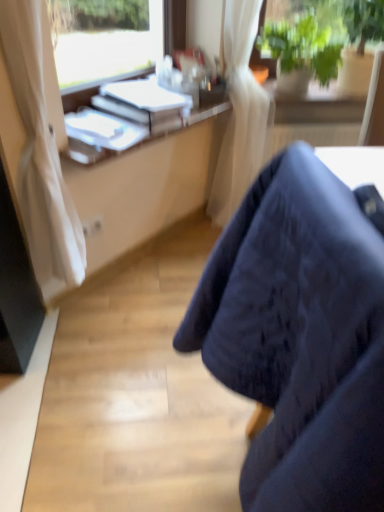
In order to face white plastic desk at upper left, should I rotate leftwards or rightwards?

To face it directly, rotate left by 4.830 degrees.

Identify the location of white paper at upper center, which is the 1th book from top to bottom. The width and height of the screenshot is (384, 512). (144, 104).

What do you see at coordinates (326, 41) in the screenshot? The width and height of the screenshot is (384, 512). I see `green leafy plant at upper right` at bounding box center [326, 41].

Describe the element at coordinates (300, 337) in the screenshot. The image size is (384, 512). I see `dark fabric chair at lower right` at that location.

At what (x,y) coordinates should I click in order to perform the action: click on white plastic desk at upper left. Please return your answer as a coordinate pair (x, y). This screenshot has width=384, height=512. Looking at the image, I should click on [88, 150].

Considering the sizes of objects white paper at upper center, which ranks as the second book in bottom-to-top order, and dark fabric chair at lower right in the image provided, who is shorter, white paper at upper center, which ranks as the second book in bottom-to-top order, or dark fabric chair at lower right?

With less height is white paper at upper center, which ranks as the second book in bottom-to-top order.

From the image's perspective, which object appears higher, white paper at upper center, which is the 1th book from top to bottom, or dark fabric chair at lower right?

white paper at upper center, which is the 1th book from top to bottom, from the image's perspective.

Who is bigger, white plastic desk at upper left or green leafy plant at upper right?

With larger size is green leafy plant at upper right.

Does white plastic desk at upper left come behind green leafy plant at upper right?

No, white plastic desk at upper left is in front of green leafy plant at upper right.

From the picture: How far apart are white plastic desk at upper left and green leafy plant at upper right?

They are 23.43 inches apart.

The image size is (384, 512). I want to click on desk in front of the green leafy plant at upper right, so click(88, 150).

Considering the sizes of white plastic desk at upper left and white paper at upper center, which is the 1th book from top to bottom, in the image, is white plastic desk at upper left bigger or smaller than white paper at upper center, which is the 1th book from top to bottom,?

Considering their sizes, white plastic desk at upper left takes up less space than white paper at upper center, which is the 1th book from top to bottom.

Does white plastic desk at upper left lie behind white paper at upper center, which ranks as the second book in bottom-to-top order?

No, the depth of white plastic desk at upper left is less than that of white paper at upper center, which ranks as the second book in bottom-to-top order.

From the image's perspective, would you say white plastic desk at upper left is positioned over white paper at upper center, which is the 1th book from top to bottom?

No.

From the picture: Considering the sizes of white plastic desk at upper left and white paper at upper center, which is the 1th book from top to bottom, in the image, is white plastic desk at upper left wider or thinner than white paper at upper center, which is the 1th book from top to bottom,?

Clearly, white plastic desk at upper left has less width compared to white paper at upper center, which is the 1th book from top to bottom.

Would you say green leafy plant at upper right is to the left or to the right of dark fabric chair at lower right in the picture?

In the image, green leafy plant at upper right appears on the right side of dark fabric chair at lower right.

Is green leafy plant at upper right shorter than dark fabric chair at lower right?

Yes, green leafy plant at upper right is shorter than dark fabric chair at lower right.

From the image's perspective, between white glossy book at upper left, arranged as the second book when viewed from the top, and white plastic desk at upper left, which one is located above?

white plastic desk at upper left appears higher in the image.

Which is farther from the camera, [81,110] or [191,123]?

The point [191,123] is farther.

Is white glossy book at upper left, placed as the 1th book when sorted from bottom to top, taller than white plastic desk at upper left?

Indeed, white glossy book at upper left, placed as the 1th book when sorted from bottom to top, has a greater height compared to white plastic desk at upper left.

Looking at this image, from the image's perspective, who appears lower, white plastic desk at upper left or dark fabric chair at lower right?

dark fabric chair at lower right.

Which is more to the right, white plastic desk at upper left or dark fabric chair at lower right?

Positioned to the right is dark fabric chair at lower right.

Which is more distant, (71, 149) or (275, 292)?

Point (71, 149)

Do you think white paper at upper center, which ranks as the second book in bottom-to-top order, is within white plastic desk at upper left, or outside of it?

white paper at upper center, which ranks as the second book in bottom-to-top order, is located beyond the bounds of white plastic desk at upper left.

Is white paper at upper center, which is the 1th book from top to bottom, positioned with its back to white plastic desk at upper left?

That's not correct — white paper at upper center, which is the 1th book from top to bottom, is not looking away from white plastic desk at upper left.

What's the angular difference between white paper at upper center, which is the 1th book from top to bottom, and white plastic desk at upper left's facing directions?

The angle between the facing direction of white paper at upper center, which is the 1th book from top to bottom, and the facing direction of white plastic desk at upper left is 0.000526 degrees.

From the image's perspective, between white paper at upper center, which is the 1th book from top to bottom, and white plastic desk at upper left, which one is located above?

white paper at upper center, which is the 1th book from top to bottom, is shown above in the image.

Where is `chair in front of the white paper at upper center, which is the 1th book from top to bottom`? This screenshot has width=384, height=512. chair in front of the white paper at upper center, which is the 1th book from top to bottom is located at coordinates (300, 337).

The width and height of the screenshot is (384, 512). I want to click on houseplant behind the white plastic desk at upper left, so click(326, 41).

Looking at the image, which one is located closer to dark fabric chair at lower right, white plastic desk at upper left or white glossy book at upper left, placed as the 1th book when sorted from bottom to top?

Based on the image, white glossy book at upper left, placed as the 1th book when sorted from bottom to top, appears to be nearer to dark fabric chair at lower right.

Which object lies nearer to the anchor point white glossy book at upper left, arranged as the second book when viewed from the top, white paper at upper center, which ranks as the second book in bottom-to-top order, or green leafy plant at upper right?

white paper at upper center, which ranks as the second book in bottom-to-top order, lies closer to white glossy book at upper left, arranged as the second book when viewed from the top, than the other object.

Considering their positions, is white glossy book at upper left, arranged as the second book when viewed from the top, positioned further to white plastic desk at upper left than dark fabric chair at lower right?

dark fabric chair at lower right.

Looking at the image, which one is located closer to dark fabric chair at lower right, white glossy book at upper left, arranged as the second book when viewed from the top, or white plastic desk at upper left?

The object closer to dark fabric chair at lower right is white glossy book at upper left, arranged as the second book when viewed from the top.

From the image, which object appears to be nearer to white plastic desk at upper left, green leafy plant at upper right or white paper at upper center, which is the 1th book from top to bottom?

white paper at upper center, which is the 1th book from top to bottom, is closer to white plastic desk at upper left.

Based on their spatial positions, is dark fabric chair at lower right or white paper at upper center, which is the 1th book from top to bottom, further from white glossy book at upper left, placed as the 1th book when sorted from bottom to top?

dark fabric chair at lower right lies further to white glossy book at upper left, placed as the 1th book when sorted from bottom to top, than the other object.

Considering their positions, is white glossy book at upper left, placed as the 1th book when sorted from bottom to top, positioned further to white plastic desk at upper left than green leafy plant at upper right?

The object further to white plastic desk at upper left is green leafy plant at upper right.

From the image, which object appears to be nearer to white glossy book at upper left, placed as the 1th book when sorted from bottom to top, dark fabric chair at lower right or green leafy plant at upper right?

dark fabric chair at lower right lies closer to white glossy book at upper left, placed as the 1th book when sorted from bottom to top, than the other object.

Locate an element on the screen. book located between white glossy book at upper left, arranged as the second book when viewed from the top, and white plastic desk at upper left in the left-right direction is located at coordinates (144, 104).

Image resolution: width=384 pixels, height=512 pixels. I want to click on desk between dark fabric chair at lower right and white paper at upper center, which ranks as the second book in bottom-to-top order, in the front-back direction, so click(88, 150).

In order to click on desk situated between white glossy book at upper left, placed as the 1th book when sorted from bottom to top, and green leafy plant at upper right from left to right in this screenshot , I will do `click(88, 150)`.

Find the location of a particular element. This screenshot has width=384, height=512. book located between white glossy book at upper left, placed as the 1th book when sorted from bottom to top, and green leafy plant at upper right in the left-right direction is located at coordinates (144, 104).